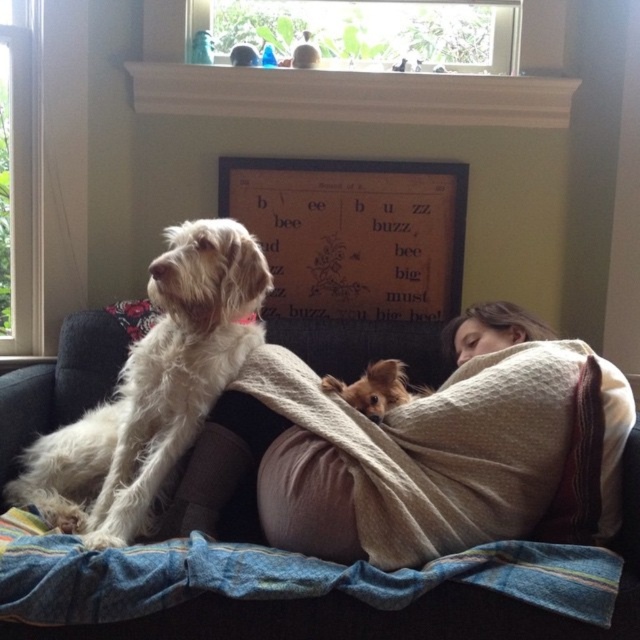
You are a pet owner trying to locate your brown fuzzy dog at lower center. You notice a denim fabric blanket at lower center in the scene. Where is the brown fuzzy dog relative to the blanket?

The denim fabric blanket at lower center is in front of the brown fuzzy dog at lower center, so the brown fuzzy dog is behind the blanket.

You are a photographer trying to capture the beige knitted blanket at center in your shot. The camera is positioned at the origin point. Which direction should you move the camera to get the blanket into frame?

The beige knitted blanket at center is located at point 0.706 on the x axis and 0.659 on the y axis. Since the camera is at the origin point, you should move the camera towards the upper right direction to capture the beige knitted blanket at center in the frame.